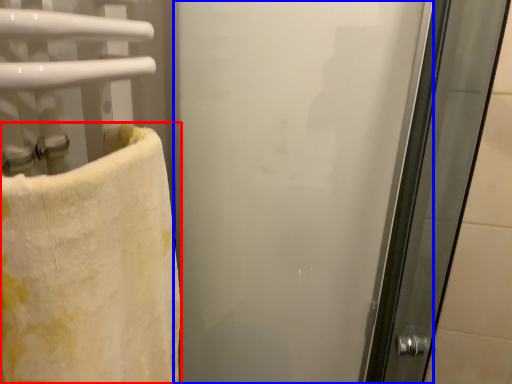
Question: Which object is closer to the camera taking this photo, towel (highlighted by a red box) or screen door (highlighted by a blue box)?

Choices:
 (A) towel
 (B) screen door

Answer: (A)